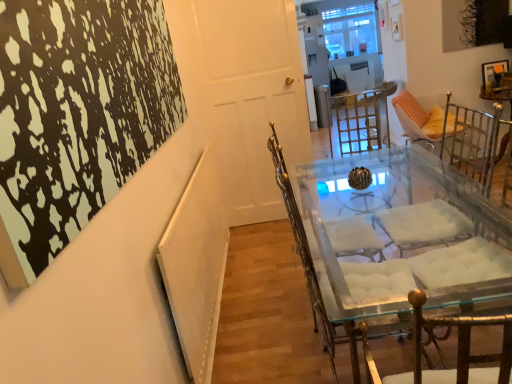
Identify the location of clear glass chair at center. This screenshot has height=384, width=512. (309, 263).

Which object is wider, white glossy door at center or clear glass chair at center?

clear glass chair at center is wider.

Considering the positions of point (220, 47) and point (354, 328), is point (220, 47) closer or farther from the camera than point (354, 328)?

Point (220, 47) is positioned farther from the camera compared to point (354, 328).

This screenshot has height=384, width=512. In the image, there is a white glossy door at center. What are the coordinates of `chair below it (from the image's perspective)` in the screenshot? It's located at (309, 263).

Is white glossy door at center with clear glass chair at center?

No, white glossy door at center is not in contact with clear glass chair at center.

Who is taller, clear glass chair at center or white glossy door at center?

white glossy door at center is taller.

Does point (313, 306) appear closer or farther from the camera than point (250, 110)?

Point (313, 306) is closer to the camera than point (250, 110).

Which object is further away from the camera, clear glass chair at center or white glossy door at center?

white glossy door at center is further away from the camera.

Would you consider clear glass chair at center to be distant from white glossy door at center?

Yes.

Which object is closer to the camera, clear glass chair at center or clear glass table at center?

clear glass table at center is more forward.

Is clear glass chair at center touching clear glass table at center?

No, clear glass chair at center is not with clear glass table at center.

Could you tell me if clear glass chair at center is facing clear glass table at center?

No, clear glass chair at center is not facing towards clear glass table at center.

Considering the relative sizes of clear glass chair at center and clear glass table at center in the image provided, is clear glass chair at center bigger than clear glass table at center?

Yes.

Would you say clear glass table at center is outside clear glass chair at center?

Yes, clear glass table at center is not within clear glass chair at center.

Is clear glass chair at center at the back of clear glass table at center?

No.

This screenshot has width=512, height=384. What are the coordinates of `chair located on the left of clear glass table at center` in the screenshot? It's located at (309, 263).

Looking at this image, which point is more forward, (408, 199) or (328, 344)?

The point (328, 344) is closer.

Considering the points (400, 156) and (243, 18), which point is behind, point (400, 156) or point (243, 18)?

The point (243, 18) is farther.

From a real-world perspective, is clear glass table at center positioned above or below white glossy door at center?

In terms of real-world spatial position, clear glass table at center is below white glossy door at center.

Would you say clear glass table at center is a long distance from white glossy door at center?

Indeed, clear glass table at center is not near white glossy door at center.

Is clear glass table at center a part of white glossy door at center?

Actually, clear glass table at center is outside white glossy door at center.

Image resolution: width=512 pixels, height=384 pixels. I want to click on door above the clear glass table at center (from the image's perspective), so click(252, 98).

Is white glossy door at center positioned far away from clear glass table at center?

Yes.

The width and height of the screenshot is (512, 384). Identify the location of door that appears above the clear glass chair at center (from a real-world perspective). (252, 98).

You are a GUI agent. You are given a task and a screenshot of the screen. Output one action in this format:
    pyautogui.click(x=<x>, y=<y>)
    Task: Click on the chair below the white glossy door at center (from the image's perspective)
    Image resolution: width=512 pixels, height=384 pixels.
    Given the screenshot: What is the action you would take?
    pyautogui.click(x=309, y=263)

Based on their spatial positions, is clear glass chair at center or white glossy door at center closer to clear glass table at center?

Based on the image, clear glass chair at center appears to be nearer to clear glass table at center.

Estimate the real-world distances between objects in this image. Which object is closer to white glossy door at center, clear glass chair at center or clear glass table at center?

Among the two, clear glass chair at center is located nearer to white glossy door at center.

Looking at the image, which one is located closer to clear glass chair at center, clear glass table at center or white glossy door at center?

The object closer to clear glass chair at center is clear glass table at center.

Considering their positions, is clear glass table at center positioned closer to white glossy door at center than clear glass chair at center?

A: The object closer to white glossy door at center is clear glass chair at center.

Looking at the image, which one is located further to clear glass chair at center, white glossy door at center or clear glass table at center?

The object further to clear glass chair at center is white glossy door at center.

Based on their spatial positions, is white glossy door at center or clear glass chair at center closer to clear glass table at center?

clear glass chair at center lies closer to clear glass table at center than the other object.

Where is `chair between clear glass table at center and white glossy door at center from front to back`? The height and width of the screenshot is (384, 512). chair between clear glass table at center and white glossy door at center from front to back is located at coordinates pos(309,263).